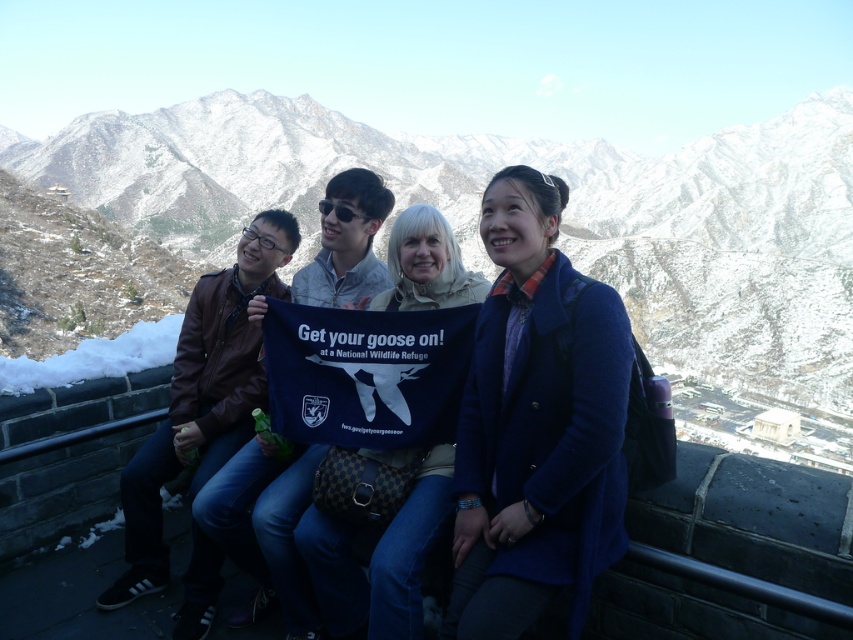
Looking at this image, which of these two, snowy rock formation at upper center or blue fabric banner at center, stands taller?

With more height is snowy rock formation at upper center.

Which is in front, point (488, 262) or point (426, 280)?

Point (426, 280) is in front.

What do you see at coordinates (563, 220) in the screenshot? I see `snowy rock formation at upper center` at bounding box center [563, 220].

Locate an element on the screen. Image resolution: width=853 pixels, height=640 pixels. snowy rock formation at upper center is located at coordinates (563, 220).

Does snowy rock formation at upper center appear on the left side of blue woolen coat at center?

No, snowy rock formation at upper center is not to the left of blue woolen coat at center.

Does snowy rock formation at upper center have a lesser width compared to blue woolen coat at center?

Incorrect, snowy rock formation at upper center's width is not less than blue woolen coat at center's.

You are a GUI agent. You are given a task and a screenshot of the screen. Output one action in this format:
    pyautogui.click(x=<x>, y=<y>)
    Task: Click on the snowy rock formation at upper center
    This screenshot has width=853, height=640.
    Given the screenshot: What is the action you would take?
    pyautogui.click(x=563, y=220)

Which is in front, point (497, 598) or point (305, 538)?

Point (497, 598)

Does blue woolen coat at center have a greater height compared to blue fabric banner at center?

Yes, blue woolen coat at center is taller than blue fabric banner at center.

Locate an element on the screen. This screenshot has height=640, width=853. blue woolen coat at center is located at coordinates (537, 424).